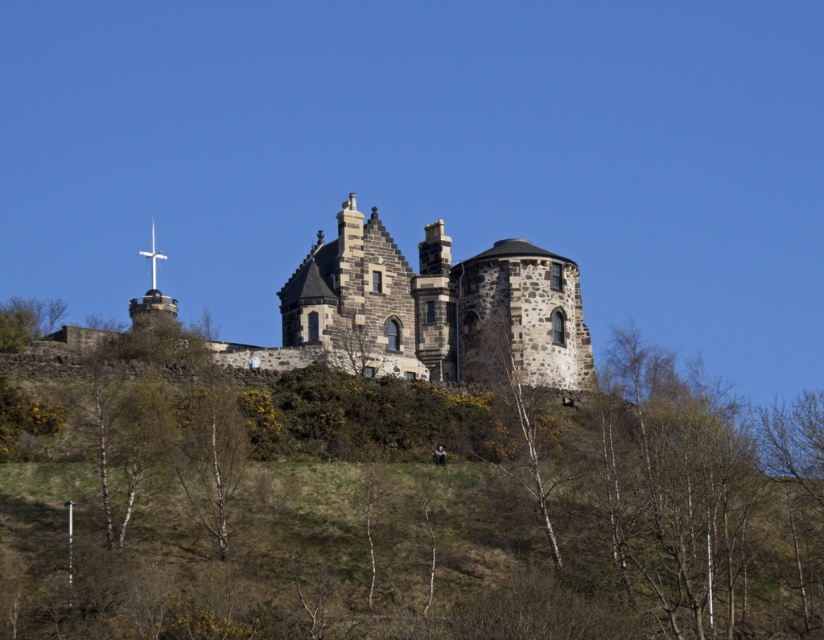
Question: Which of the following is the farthest from the observer?

Choices:
 (A) white metallic cross at upper center
 (B) green leafy tree at center
 (C) smooth white birch at lower center

Answer: (A)

Question: Observing the image, what is the correct spatial positioning of green leafy tree at center in reference to smooth white birch at lower center?

Choices:
 (A) right
 (B) left

Answer: (A)

Question: Can you confirm if dark gray stone castle at center is bigger than bare wood tree at center?

Choices:
 (A) no
 (B) yes

Answer: (B)

Question: Which point is closer to the camera?

Choices:
 (A) white metallic cross at upper center
 (B) green leafy tree at upper left
 (C) smooth white birch at lower center
 (D) green leafy tree at center

Answer: (D)

Question: Which point is farther to the camera?

Choices:
 (A) green leafy tree at upper left
 (B) green leafy tree at center
 (C) white metallic cross at upper center

Answer: (C)

Question: Does smooth white birch at lower center lie behind bare wood tree at center?

Choices:
 (A) yes
 (B) no

Answer: (B)